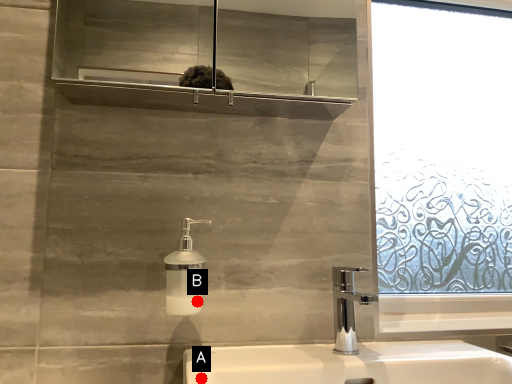
Question: Two points are circled on the image, labeled by A and B beside each circle. Which of the following is the farthest from the observer?

Choices:
 (A) A is further
 (B) B is further

Answer: (B)